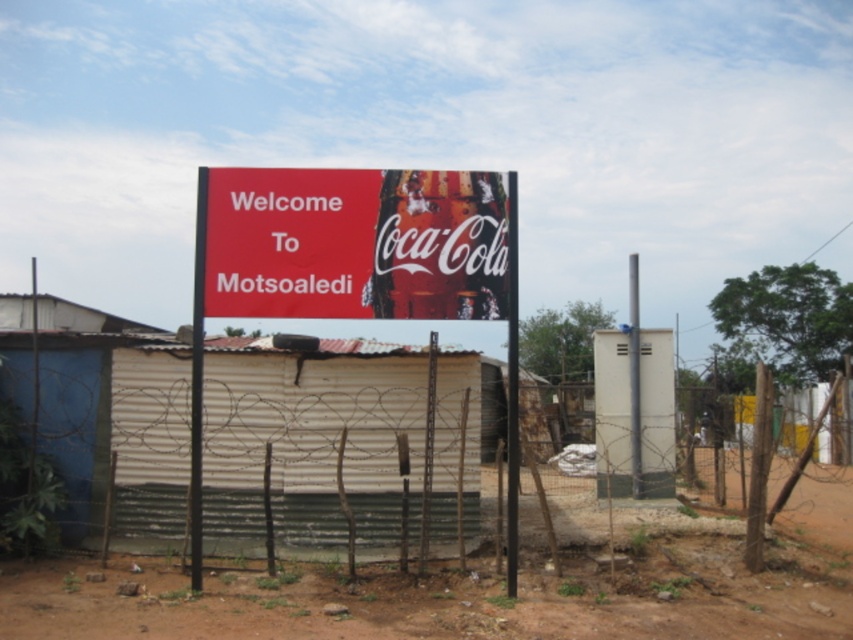
You are a delivery person standing at the edge of the brown dirt field at center. You need to reach the red matte signboard at center to drop off a package. Can you walk directly to the signboard without crossing any obstacles?

The distance between the brown dirt field at center and the red matte signboard at center is 9.40 feet, so yes, you can walk directly to the signboard without crossing any obstacles as there are no mentioned barriers between them.

You are standing in front of the red signboard with the Coca Cola logo. You notice two points marked on the image. One is at point (82, 618) and the other at point (265, 244). Which point is closer to you?

Point (82, 618) is closer to you because it is in front of point (265, 244).

You are standing in front of the rural scene with the red signboard and barbed wire fence. There is a specific point marked at coordinates point (309, 442). What does this point indicate in the scene?

The point (309, 442) marks the location of the rusty wire fence at center.